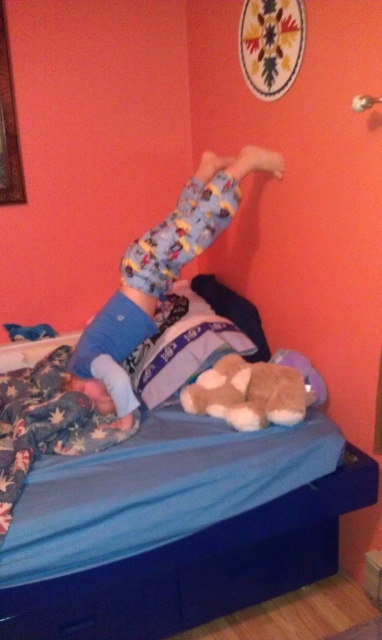
You are a photographer trying to capture the printed cotton pajama pants at center and the blue soft pillow at center in a single shot. Which object should you focus on first to ensure both are in frame?

You should focus on the blue soft pillow at center first because the printed cotton pajama pants at center is in front of it, so adjusting the focus to the pillow ensures both are within the frame.